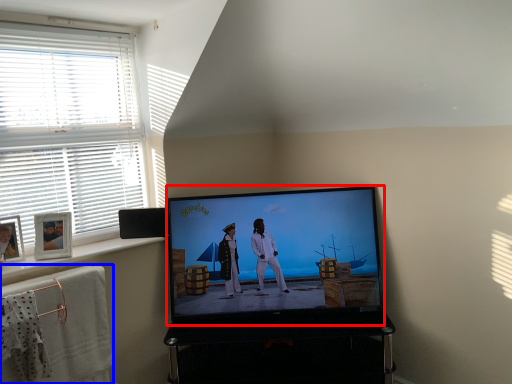
Question: Which object appears farthest to the camera in this image, television (highlighted by a red box) or bath towel (highlighted by a blue box)?

Choices:
 (A) television
 (B) bath towel

Answer: (A)